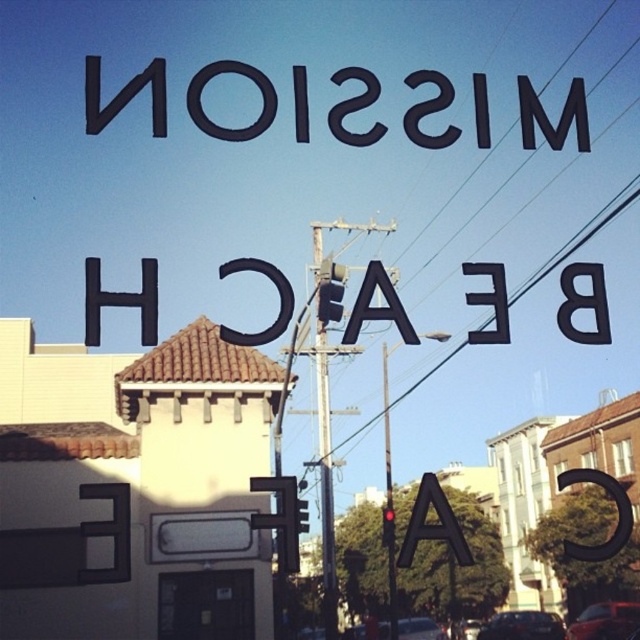
You are a city planner analyzing the layout of this street scene. You need to determine if the black matte sign at upper center can be replaced with a wider advertisement board without obstructing the metallic gray pole at center. Based on their current widths, is this feasible?

The black matte sign at upper center is wider than the metallic gray pole at center. Replacing it with an even wider advertisement board would likely obstruct the pole, so it is not feasible.

You are a city planner assessing the safety of the traffic light installation. The traffic light is attached to the metallic gray pole at center. Considering the height difference between the pole and the metallic wire at center, would the traffic light interfere with the wire?

The metallic gray pole at center is much taller than the metallic wire at center, so the traffic light attached to the pole would not interfere with the wire as it is positioned higher up.